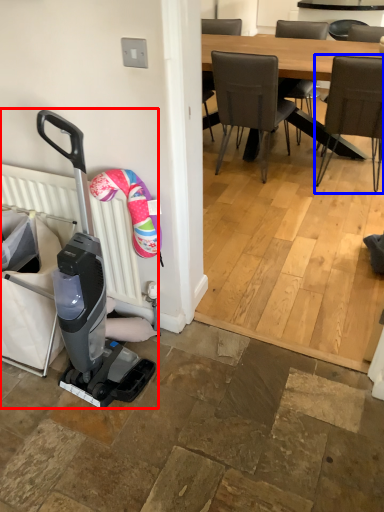
Question: Which object appears farthest to the camera in this image, baby carriage (highlighted by a red box) or chair (highlighted by a blue box)?

Choices:
 (A) baby carriage
 (B) chair

Answer: (B)